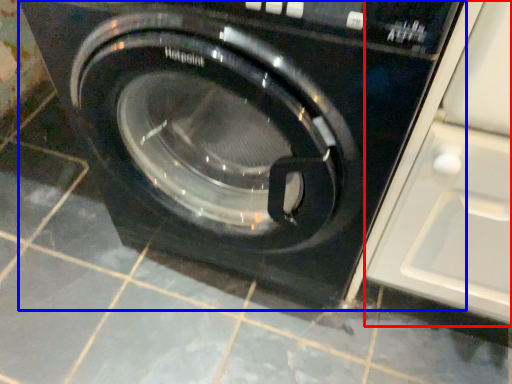
Question: Which of the following is the farthest to the observer, glass door (highlighted by a red box) or washing machine (highlighted by a blue box)?

Choices:
 (A) glass door
 (B) washing machine

Answer: (B)